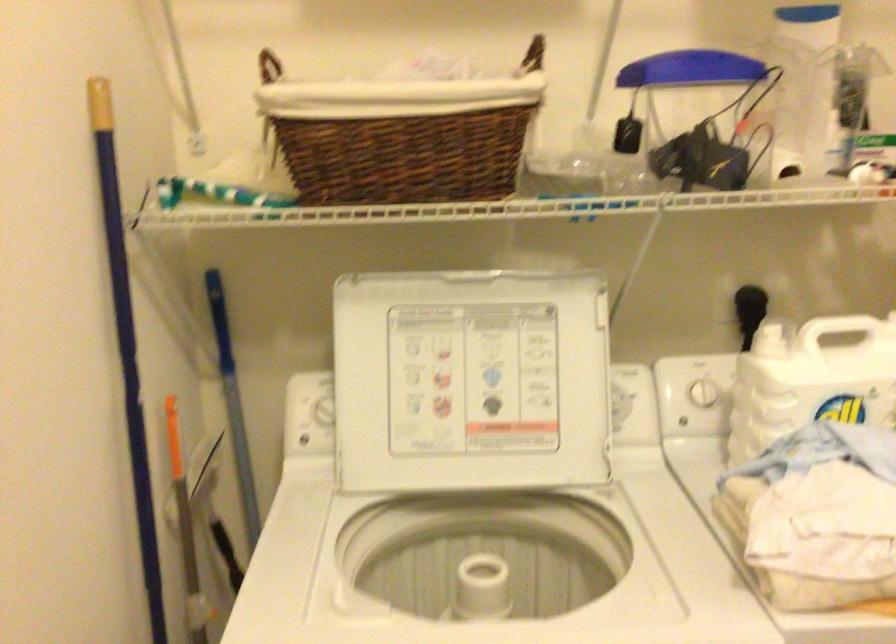
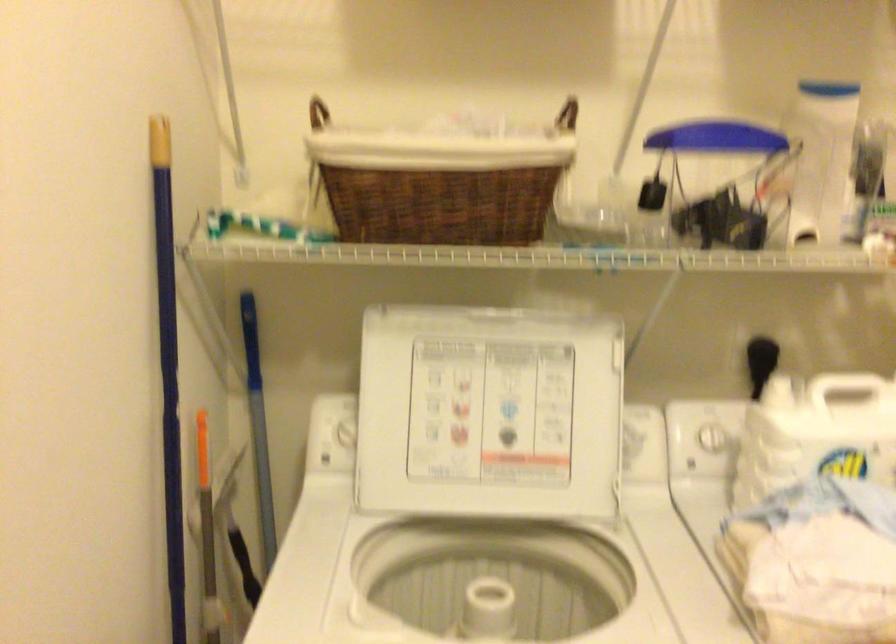
Locate, in the second image, the point that corresponds to point (687, 395) in the first image.

(698, 440)